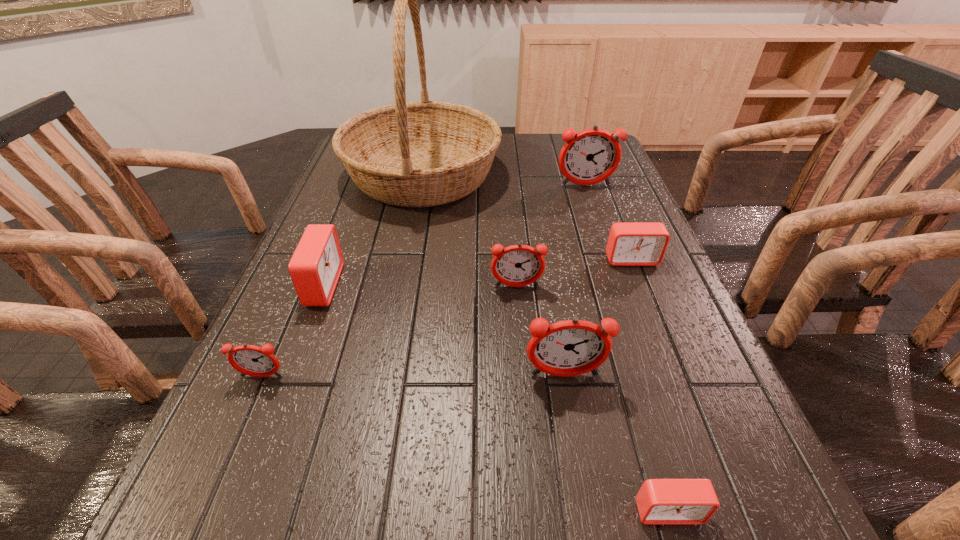
Image resolution: width=960 pixels, height=540 pixels. What are the coordinates of `basket present at the left edge` in the screenshot? It's located at (424, 153).

What are the coordinates of `object at the far left corner` in the screenshot? It's located at (424, 153).

What are the coordinates of `object at the near right corner` in the screenshot? It's located at (659, 501).

Identify the location of free space at the far edge. (538, 165).

In the image, there is a desktop. Identify the location of vacant space at the left edge. (296, 367).

Identify the location of vacant space at the right edge. This screenshot has width=960, height=540. (603, 206).

In the image, there is a desktop. Where is `vacant space at the near right corner`? The height and width of the screenshot is (540, 960). vacant space at the near right corner is located at coordinates click(729, 521).

You are a GUI agent. You are given a task and a screenshot of the screen. Output one action in this format:
    pyautogui.click(x=<x>, y=<y>)
    Task: Click on the free area in between the third tallest object and the leftmost red alarm clock
    
    Given the screenshot: What is the action you would take?
    pyautogui.click(x=444, y=330)

The image size is (960, 540). I want to click on free space between the leftmost reddish-pink alarm clock and the leftmost red alarm clock, so click(292, 331).

Identify the location of vacant area between the biggest red alarm clock and the second smallest reddish-pink alarm clock. Image resolution: width=960 pixels, height=540 pixels. tap(420, 286).